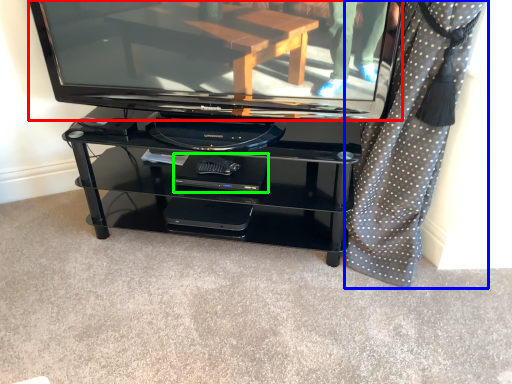
Question: Based on their relative distances, which object is nearer to television (highlighted by a red box)? Choose from curtain (highlighted by a blue box) and footrest (highlighted by a green box).

Choices:
 (A) curtain
 (B) footrest

Answer: (B)